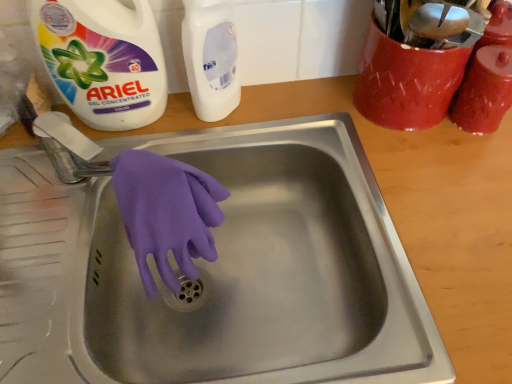
Question: From a real-world perspective, is stainless steel sink at center physically below white matte bottle at upper center, which ranks as the 2th cleaning product in right-to-left order?

Choices:
 (A) no
 (B) yes

Answer: (B)

Question: From the image's perspective, would you say stainless steel sink at center is shown under white matte bottle at upper center, acting as the 2th cleaning product starting from the left?

Choices:
 (A) yes
 (B) no

Answer: (A)

Question: Is stainless steel sink at center outside white matte bottle at upper center, which ranks as the 2th cleaning product in right-to-left order?

Choices:
 (A) yes
 (B) no

Answer: (A)

Question: Considering the relative sizes of stainless steel sink at center and white matte bottle at upper center, acting as the 2th cleaning product starting from the left, in the image provided, is stainless steel sink at center thinner than white matte bottle at upper center, acting as the 2th cleaning product starting from the left,?

Choices:
 (A) no
 (B) yes

Answer: (A)

Question: Is stainless steel sink at center positioned with its back to white matte bottle at upper center, which ranks as the 2th cleaning product in right-to-left order?

Choices:
 (A) no
 (B) yes

Answer: (A)

Question: In terms of width, does stainless steel sink at center look wider or thinner when compared to matte red jar at upper right, which is the 1th cleaning product from right to left?

Choices:
 (A) wide
 (B) thin

Answer: (A)

Question: Considering the relative positions of stainless steel sink at center and matte red jar at upper right, the third cleaning product positioned from the left, in the image provided, is stainless steel sink at center to the left or to the right of matte red jar at upper right, the third cleaning product positioned from the left,?

Choices:
 (A) left
 (B) right

Answer: (A)

Question: Which is correct: stainless steel sink at center is inside matte red jar at upper right, the third cleaning product positioned from the left, or outside of it?

Choices:
 (A) inside
 (B) outside

Answer: (B)

Question: In terms of size, does stainless steel sink at center appear bigger or smaller than matte red jar at upper right, which is the 1th cleaning product from right to left?

Choices:
 (A) small
 (B) big

Answer: (B)

Question: Is point (483, 107) closer or farther from the camera than point (190, 11)?

Choices:
 (A) farther
 (B) closer

Answer: (A)

Question: Is matte red jar at upper right, which is the 1th cleaning product from right to left, inside the boundaries of white matte bottle at upper center, acting as the 2th cleaning product starting from the left, or outside?

Choices:
 (A) outside
 (B) inside

Answer: (A)

Question: From the image's perspective, is matte red jar at upper right, the third cleaning product positioned from the left, positioned above or below white matte bottle at upper center, acting as the 2th cleaning product starting from the left?

Choices:
 (A) below
 (B) above

Answer: (A)

Question: From their relative heights in the image, would you say matte red jar at upper right, which is the 1th cleaning product from right to left, is taller or shorter than white matte bottle at upper center, which ranks as the 2th cleaning product in right-to-left order?

Choices:
 (A) tall
 (B) short

Answer: (B)

Question: From the image's perspective, is stainless steel sink at center positioned above or below purple rubber glove at sink center?

Choices:
 (A) above
 (B) below

Answer: (B)

Question: Based on their sizes in the image, would you say stainless steel sink at center is bigger or smaller than purple rubber glove at sink center?

Choices:
 (A) big
 (B) small

Answer: (A)